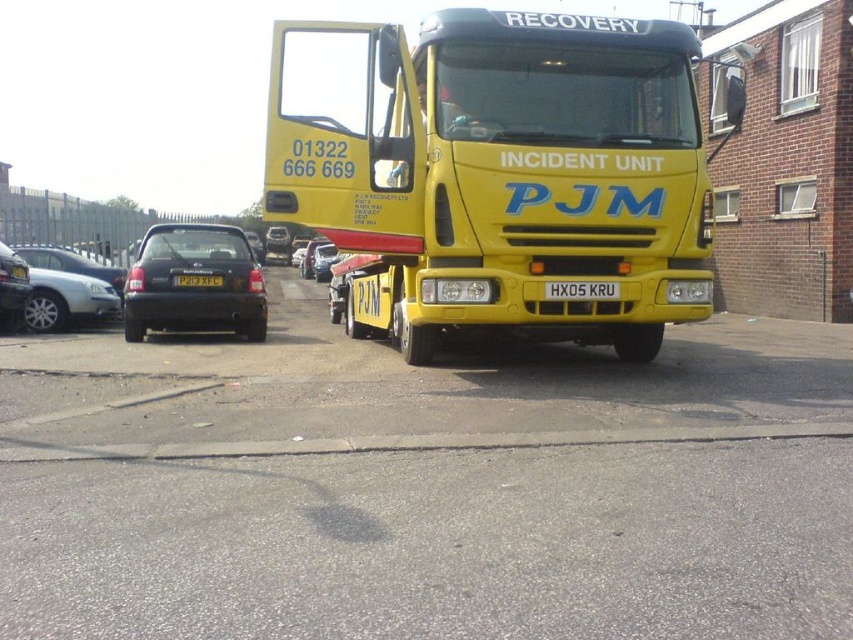
Question: Which point appears closest to the camera in this image?

Choices:
 (A) (573, 252)
 (B) (755, 636)

Answer: (B)

Question: Does yellow matte truck at center appear on the right side of yellow matte tow truck at center?

Choices:
 (A) no
 (B) yes

Answer: (A)

Question: Does yellow matte truck at center appear on the left side of black matte hatchback at left?

Choices:
 (A) yes
 (B) no

Answer: (B)

Question: Among these objects, which one is nearest to the camera?

Choices:
 (A) black matte hatchback at left
 (B) white rectangular license plate at center
 (C) yellow matte tow truck at center
 (D) yellow matte license plate at center

Answer: (C)

Question: Which point is closer to the camera?

Choices:
 (A) yellow matte truck at center
 (B) yellow matte tow truck at center
 (C) black metallic car at left
 (D) yellow matte license plate at center

Answer: (A)

Question: Is yellow matte truck at center closer to the viewer compared to white rectangular license plate at center?

Choices:
 (A) no
 (B) yes

Answer: (B)